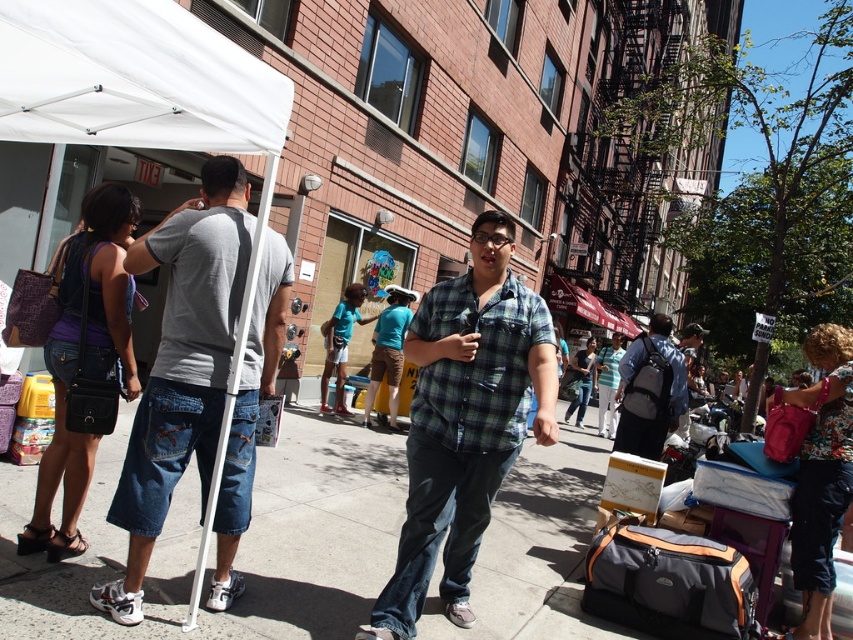
How distant is green plaid shirt at center from matte gray backpack at center?

The distance of green plaid shirt at center from matte gray backpack at center is 3.29 meters.

Which of these two, green plaid shirt at center or matte gray backpack at center, stands shorter?

matte gray backpack at center

The width and height of the screenshot is (853, 640). I want to click on green plaid shirt at center, so click(x=465, y=420).

Is the position of denim shorts at left less distant than that of green plaid shirt at center?

No, it is behind green plaid shirt at center.

Is denim shorts at left taller than green plaid shirt at center?

Yes.

Who is more distant from viewer, [236,246] or [544,364]?

Positioned behind is point [544,364].

Identify the location of denim shorts at left. The width and height of the screenshot is (853, 640). (181, 365).

Between white fabric canopy at upper left and matte gray backpack at center, which one has more height?

matte gray backpack at center

Identify the location of white fabric canopy at upper left. (132, 80).